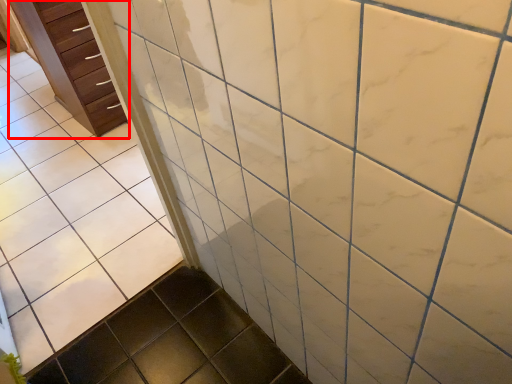
Question: From the image's perspective, what is the correct spatial relationship of chest of drawers (annotated by the red box) in relation to ceramic tile?

Choices:
 (A) below
 (B) above

Answer: (B)